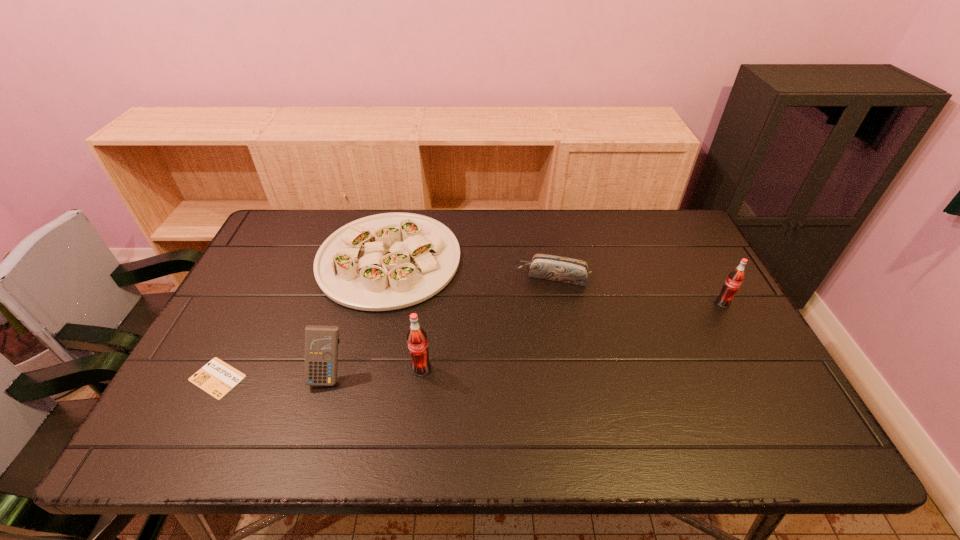
Find the location of a particular element. The height and width of the screenshot is (540, 960). the tallest object is located at coordinates [x=418, y=347].

Find the location of a particular element. The width and height of the screenshot is (960, 540). the taller soda bottle is located at coordinates (418, 347).

Locate an element on the screen. The width and height of the screenshot is (960, 540). the right soda bottle is located at coordinates (735, 278).

You are a GUI agent. You are given a task and a screenshot of the screen. Output one action in this format:
    pyautogui.click(x=<x>, y=<y>)
    Task: Click on the rightmost object
    
    Given the screenshot: What is the action you would take?
    pyautogui.click(x=735, y=278)

Identify the location of platter. The width and height of the screenshot is (960, 540). (388, 261).

Image resolution: width=960 pixels, height=540 pixels. In order to click on the fifth object from left to right in this screenshot , I will do `click(549, 267)`.

Locate an element on the screen. The width and height of the screenshot is (960, 540). calculator is located at coordinates (321, 342).

Find the location of a particular element. the shortest object is located at coordinates (217, 378).

In order to click on the leftmost object in this screenshot , I will do `click(217, 378)`.

At what (x,y) coordinates should I click in order to perform the action: click on free spot located on the label of the left soda bottle. Please return your answer as a coordinate pair (x, y). The height and width of the screenshot is (540, 960). Looking at the image, I should click on (417, 406).